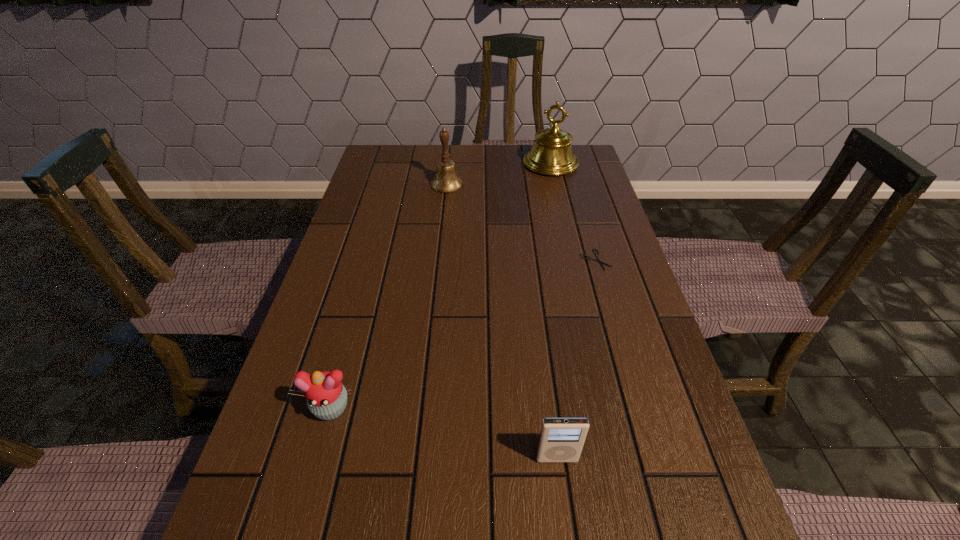
This screenshot has width=960, height=540. In order to click on free spot located on the back of the third nearest object in this screenshot , I will do `click(588, 235)`.

At what (x,y) coordinates should I click in order to perform the action: click on object that is at the left edge. Please return your answer as a coordinate pair (x, y). The width and height of the screenshot is (960, 540). Looking at the image, I should click on (326, 396).

Image resolution: width=960 pixels, height=540 pixels. Find the location of `bell positioned at the right edge`. bell positioned at the right edge is located at coordinates (552, 154).

The height and width of the screenshot is (540, 960). What are the coordinates of `shears present at the right edge` in the screenshot? It's located at (589, 258).

Where is `object that is at the far right corner`? Image resolution: width=960 pixels, height=540 pixels. object that is at the far right corner is located at coordinates click(x=552, y=154).

Locate an element on the screen. The width and height of the screenshot is (960, 540). vacant region at the far edge of the desktop is located at coordinates (464, 152).

Where is `vacant space at the left edge`? vacant space at the left edge is located at coordinates (346, 334).

Image resolution: width=960 pixels, height=540 pixels. What are the coordinates of `free space at the right edge of the desktop` in the screenshot? It's located at (582, 273).

Where is `free location at the far left corner of the desktop`? This screenshot has height=540, width=960. free location at the far left corner of the desktop is located at coordinates (408, 156).

The height and width of the screenshot is (540, 960). In order to click on vacant area at the far right corner in this screenshot , I will do `click(580, 156)`.